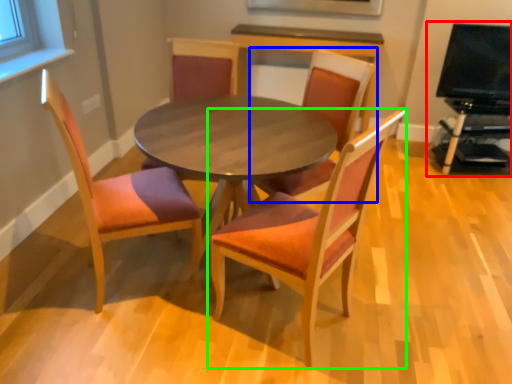
Question: Considering the real-world distances, which object is closest to entertainment center (highlighted by a red box)? chair (highlighted by a blue box) or chair (highlighted by a green box).

Choices:
 (A) chair
 (B) chair

Answer: (A)